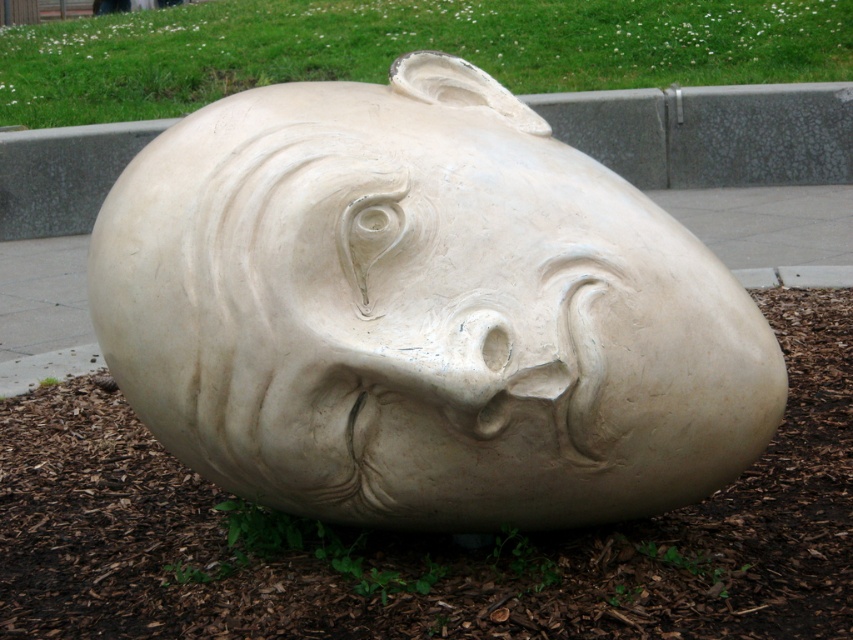
What do you see at coordinates (422, 312) in the screenshot? I see `white stone sculpture at center` at bounding box center [422, 312].

Find the location of a particular element. The image size is (853, 640). white stone sculpture at center is located at coordinates (422, 312).